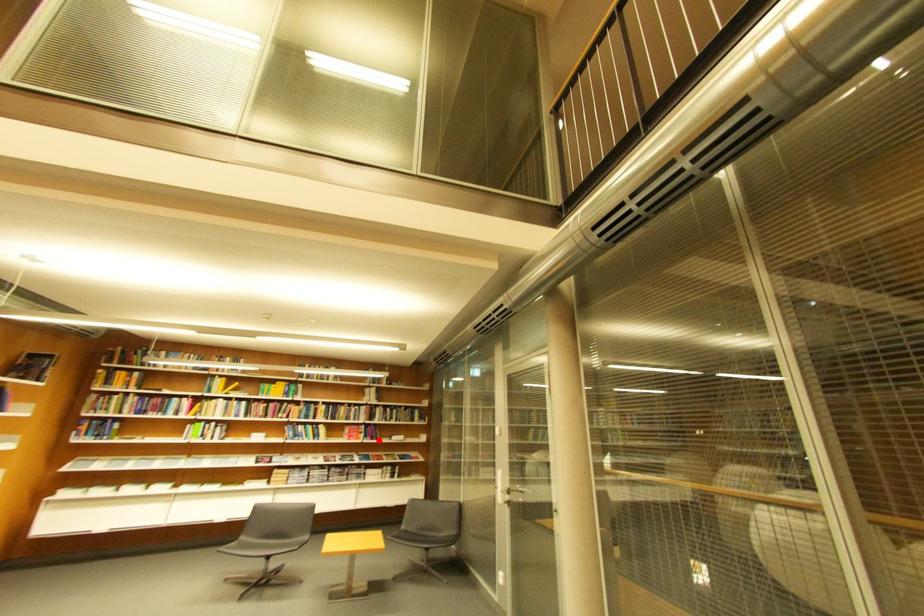
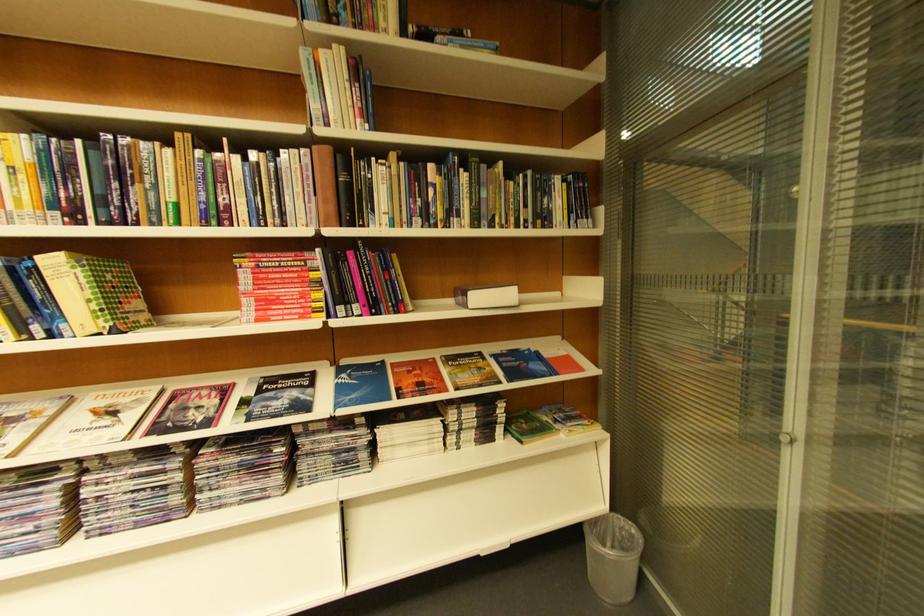
Question: I am providing you with two images of the same scene from different viewpoints. Image1 has a red point marked. In image2, the corresponding 3D location appears at what relative position? Reply with the corresponding letter.

Choices:
 (A) Closer
 (B) Farther

Answer: (A)